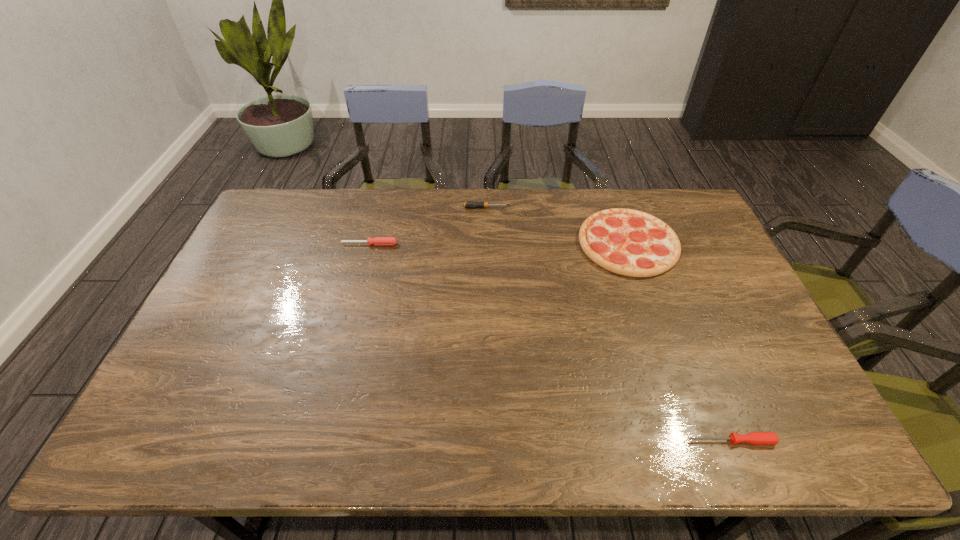
The width and height of the screenshot is (960, 540). What are the coordinates of `vacant point located at the tip of the nearest screwdriver` in the screenshot? It's located at (564, 441).

What are the coordinates of `free spot located 0.340m at the tip of the nearest screwdriver` in the screenshot? It's located at (537, 441).

Locate an element on the screen. Image resolution: width=960 pixels, height=540 pixels. vacant space located 0.370m at the tip of the nearest screwdriver is located at coordinates (524, 441).

Identify the location of pizza situated at the far edge. This screenshot has height=540, width=960. (628, 242).

Where is `screwdriver positioned at the far edge`? This screenshot has width=960, height=540. screwdriver positioned at the far edge is located at coordinates (469, 204).

I want to click on object that is at the near edge, so click(755, 438).

Identify the location of pizza that is positioned at the right edge. The width and height of the screenshot is (960, 540). (628, 242).

What are the coordinates of `screwdriver positioned at the right edge` in the screenshot? It's located at (755, 438).

The width and height of the screenshot is (960, 540). Identify the location of object at the far right corner. (628, 242).

The width and height of the screenshot is (960, 540). In order to click on object that is at the near right corner in this screenshot , I will do `click(755, 438)`.